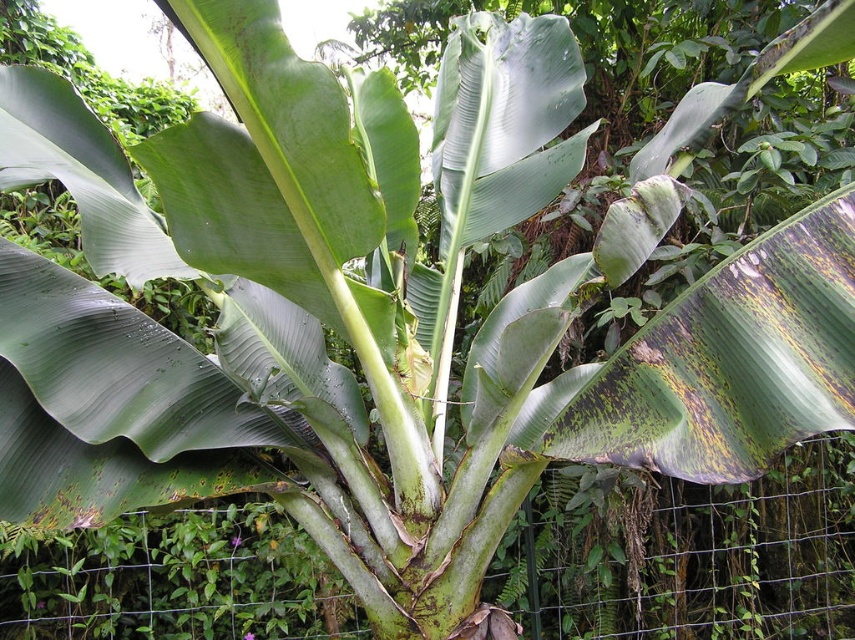
Question: Is yellow-green spotted leaf at center-right closer to the viewer compared to green matte leaf at upper left?

Choices:
 (A) yes
 (B) no

Answer: (A)

Question: Is yellow-green spotted leaf at center-right below green smooth leaf at center?

Choices:
 (A) yes
 (B) no

Answer: (A)

Question: Which point is closer to the camera?

Choices:
 (A) green matte leaf at upper left
 (B) wire mesh fence at center

Answer: (A)

Question: Which object is the closest to the wire mesh fence at center?

Choices:
 (A) yellow-green spotted leaf at center-right
 (B) green smooth leaf at center

Answer: (A)

Question: Is the position of wire mesh fence at center less distant than that of yellow-green spotted leaf at center-right?

Choices:
 (A) yes
 (B) no

Answer: (B)

Question: Estimate the real-world distances between objects in this image. Which object is closer to the green matte leaf at upper left?

Choices:
 (A) yellow-green spotted leaf at center-right
 (B) wire mesh fence at center

Answer: (A)